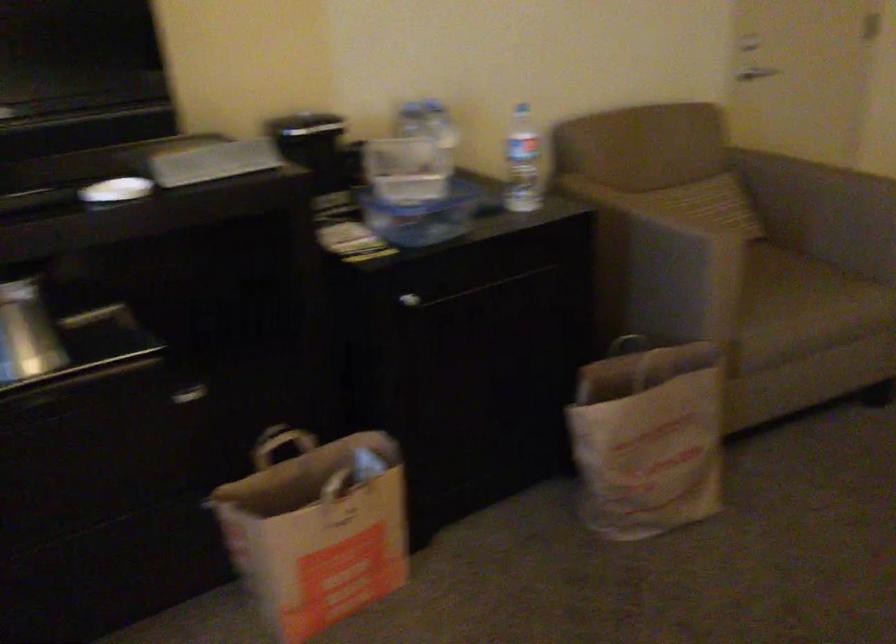
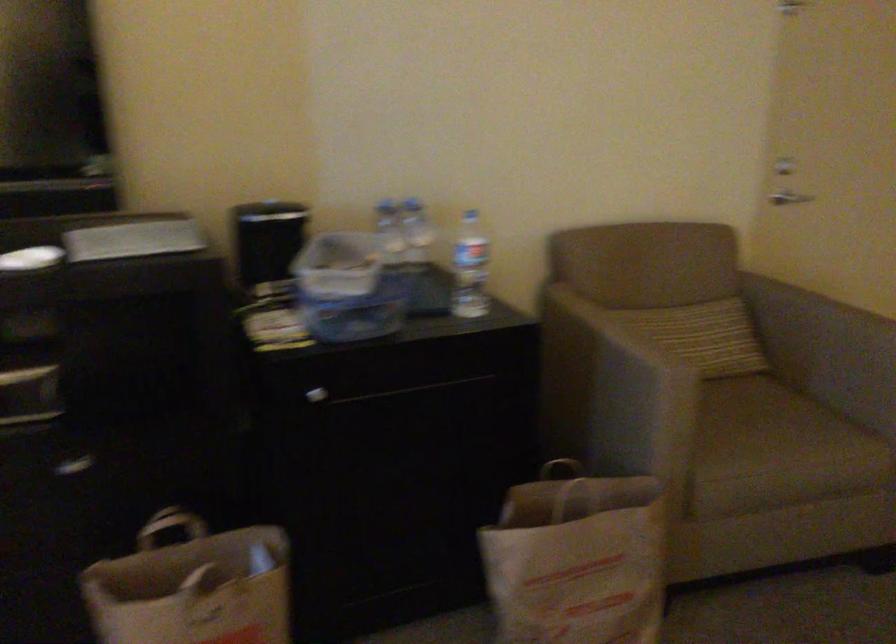
Find the pixel in the second image that matches pixel 804 172 in the first image.

(807, 308)